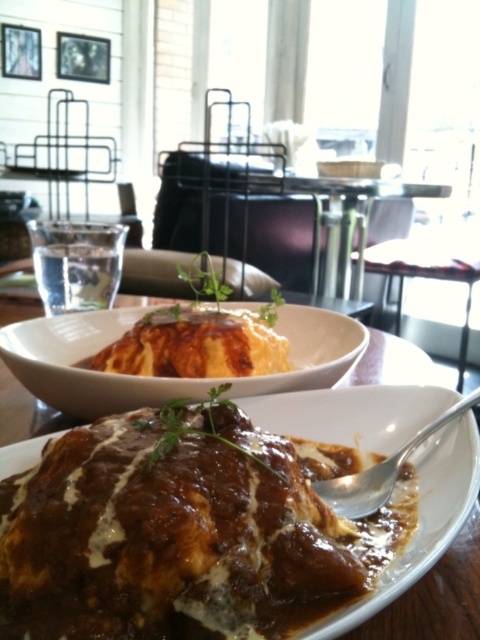
Question: Among these objects, which one is nearest to the camera?

Choices:
 (A) saucy brown meat at center
 (B) golden brown cheese at center
 (C) white glossy bowl at upper center

Answer: (A)

Question: Is golden brown cheese at center to the right of silver spoon at lower right from the viewer's perspective?

Choices:
 (A) yes
 (B) no

Answer: (B)

Question: Does saucy brown meat at center appear over silver spoon at lower right?

Choices:
 (A) no
 (B) yes

Answer: (A)

Question: Which point appears farthest from the camera in this image?

Choices:
 (A) tap(194, 284)
 (B) tap(162, 492)
 (C) tap(260, 378)
 (D) tap(396, 474)

Answer: (A)

Question: Estimate the real-world distances between objects in this image. Which object is farther from the silver spoon at lower right?

Choices:
 (A) saucy brown meat at center
 (B) white glossy bowl at upper center

Answer: (B)

Question: Does white glossy bowl at upper center come in front of golden brown cheese at center?

Choices:
 (A) yes
 (B) no

Answer: (A)